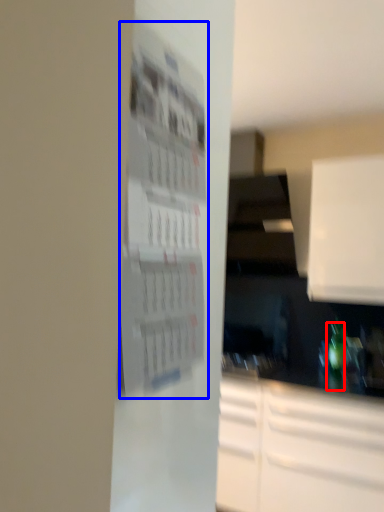
Question: Which point is closer to the camera, bottle (highlighted by a red box) or bulletin board (highlighted by a blue box)?

Choices:
 (A) bottle
 (B) bulletin board

Answer: (B)